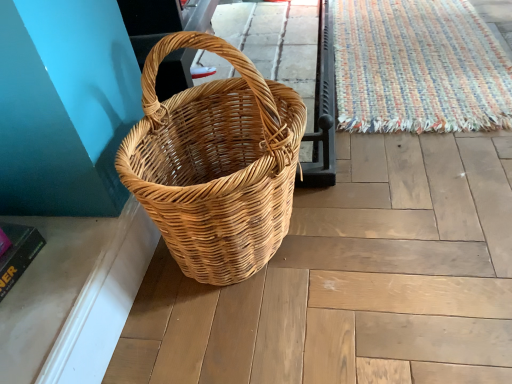
Question: Can we say woven wood basket at left lies outside woven multicolored mat at upper right?

Choices:
 (A) yes
 (B) no

Answer: (A)

Question: Is woven wood basket at left looking in the opposite direction of woven multicolored mat at upper right?

Choices:
 (A) no
 (B) yes

Answer: (A)

Question: Is woven wood basket at left bigger than woven multicolored mat at upper right?

Choices:
 (A) yes
 (B) no

Answer: (A)

Question: Are woven wood basket at left and woven multicolored mat at upper right making contact?

Choices:
 (A) no
 (B) yes

Answer: (A)

Question: Is woven wood basket at left taller than woven multicolored mat at upper right?

Choices:
 (A) no
 (B) yes

Answer: (B)

Question: Does woven wood basket at left have a lesser width compared to woven multicolored mat at upper right?

Choices:
 (A) yes
 (B) no

Answer: (A)

Question: Can we say woven multicolored mat at upper right lies outside woven wood basket at left?

Choices:
 (A) no
 (B) yes

Answer: (B)

Question: Is woven multicolored mat at upper right taller than woven wood basket at left?

Choices:
 (A) yes
 (B) no

Answer: (B)

Question: From a real-world perspective, is woven multicolored mat at upper right on woven wood basket at left?

Choices:
 (A) yes
 (B) no

Answer: (B)

Question: Is woven multicolored mat at upper right closer to the viewer compared to woven wood basket at left?

Choices:
 (A) yes
 (B) no

Answer: (B)

Question: From the image's perspective, is woven multicolored mat at upper right located above woven wood basket at left?

Choices:
 (A) no
 (B) yes

Answer: (B)

Question: Does woven multicolored mat at upper right touch woven wood basket at left?

Choices:
 (A) yes
 (B) no

Answer: (B)

Question: Would you say woven wood basket at left is inside or outside woven multicolored mat at upper right?

Choices:
 (A) outside
 (B) inside

Answer: (A)